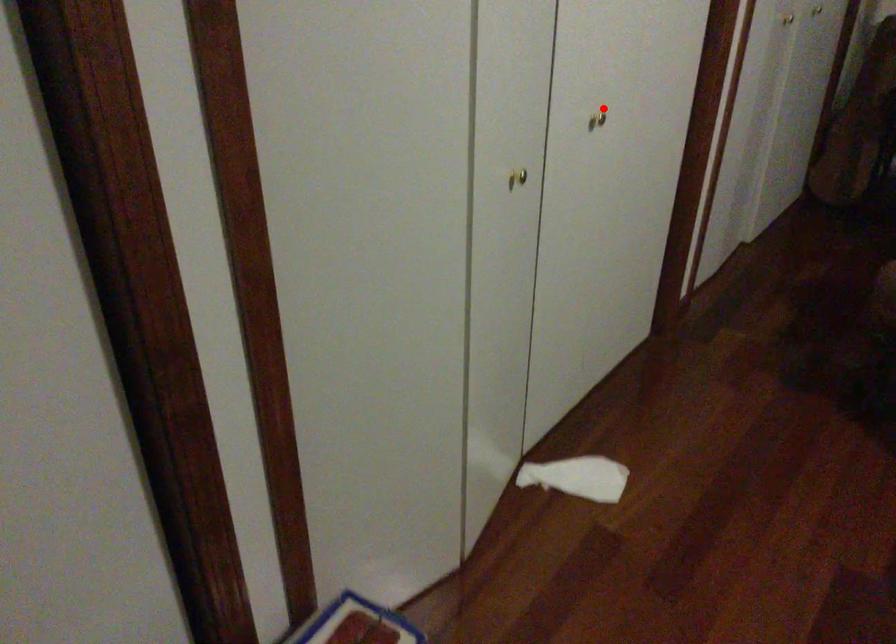
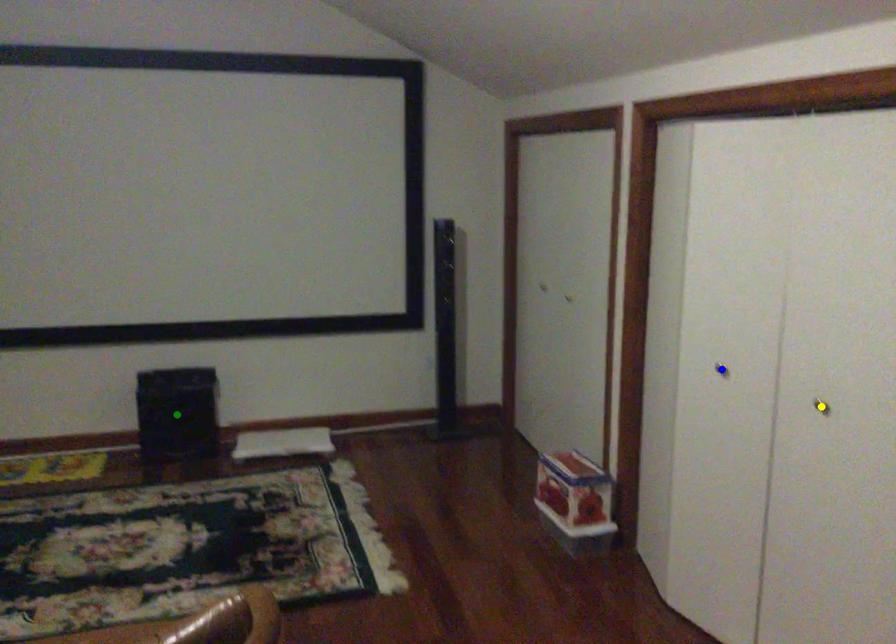
Question: I am providing you with two images of the same scene from different viewpoints. A red point is marked on the first image. You are given multiple points on the second image. Can you choose the point in image 2 that corresponds to the point in image 1?

Choices:
 (A) green point
 (B) yellow point
 (C) blue point

Answer: (B)